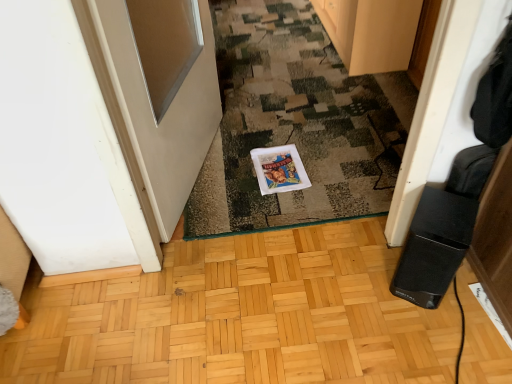
The width and height of the screenshot is (512, 384). What do you see at coordinates (434, 247) in the screenshot?
I see `black plastic speaker at lower right` at bounding box center [434, 247].

Find the location of a particular element. This screenshot has width=512, height=384. camouflage carpet at center is located at coordinates (296, 124).

Is wooden cabinet at upper center wider than camouflage carpet at center?

No, wooden cabinet at upper center is not wider than camouflage carpet at center.

Does point (394, 45) come in front of point (185, 211)?

No, (394, 45) is behind (185, 211).

Who is more distant, wooden cabinet at upper center or camouflage carpet at center?

Positioned behind is wooden cabinet at upper center.

Consider the image. Looking at the image, does white glossy door at left seem bigger or smaller compared to camouflage carpet at center?

Clearly, white glossy door at left is smaller in size than camouflage carpet at center.

From a real-world perspective, which object rests below the other?

camouflage carpet at center is physically lower.

Do you think white glossy door at left is within camouflage carpet at center, or outside of it?

white glossy door at left lies outside camouflage carpet at center.

Is white glossy postcard at center with black plastic speaker at lower right?

white glossy postcard at center and black plastic speaker at lower right are clearly separated.

From the image's perspective, would you say white glossy postcard at center is shown under black plastic speaker at lower right?

No, from the image's perspective, white glossy postcard at center is not below black plastic speaker at lower right.

Would you say white glossy postcard at center contains black plastic speaker at lower right?

Definitely not — black plastic speaker at lower right is not inside white glossy postcard at center.

From the image's perspective, would you say black plastic speaker at lower right is shown under white glossy door at left?

Yes, from the image's perspective, black plastic speaker at lower right is below white glossy door at left.

From a real-world perspective, who is located higher, black plastic speaker at lower right or white glossy door at left?

white glossy door at left, from a real-world perspective.

Does black plastic speaker at lower right have a larger size compared to white glossy door at left?

No.

Is black plastic speaker at lower right aimed at white glossy door at left?

No, black plastic speaker at lower right is not aimed at white glossy door at left.

From a real-world perspective, relative to black plastic speaker at lower right, is camouflage carpet at center vertically above or below?

In terms of real-world spatial position, camouflage carpet at center is below black plastic speaker at lower right.

Which is behind, point (258, 88) or point (445, 205)?

The point (258, 88) is more distant.

Is camouflage carpet at center far from black plastic speaker at lower right?

camouflage carpet at center is actually quite close to black plastic speaker at lower right.

From a real-world perspective, is white glossy door at left over wooden cabinet at upper center?

Indeed, from a real-world perspective, white glossy door at left stands above wooden cabinet at upper center.

In the image, is white glossy door at left positioned in front of or behind wooden cabinet at upper center?

white glossy door at left is positioned closer to the viewer than wooden cabinet at upper center.

Considering the sizes of objects white glossy door at left and wooden cabinet at upper center in the image provided, who is smaller, white glossy door at left or wooden cabinet at upper center?

white glossy door at left is smaller.

Locate an element on the screen. appliance on the right side of white glossy door at left is located at coordinates (434, 247).

Is white glossy door at left to the right of black plastic speaker at lower right from the viewer's perspective?

Incorrect, white glossy door at left is not on the right side of black plastic speaker at lower right.

Is point (162, 184) in front of point (424, 263)?

That is False.

Looking at their sizes, would you say white glossy door at left is wider or thinner than black plastic speaker at lower right?

Clearly, white glossy door at left has less width compared to black plastic speaker at lower right.

At what (x,y) coordinates should I click in order to perform the action: click on doormat on the left side of wooden cabinet at upper center. Please return your answer as a coordinate pair (x, y). The image size is (512, 384). Looking at the image, I should click on (296, 124).

Locate an element on the screen. The width and height of the screenshot is (512, 384). door located in front of the camouflage carpet at center is located at coordinates (165, 114).

When comparing their distances from black plastic speaker at lower right, does white glossy door at left or camouflage carpet at center seem closer?

camouflage carpet at center is positioned closer to the anchor black plastic speaker at lower right.

Which object lies further to the anchor point white glossy postcard at center, black plastic speaker at lower right or camouflage carpet at center?

Based on the image, black plastic speaker at lower right appears to be further to white glossy postcard at center.

Looking at the image, which one is located closer to black plastic speaker at lower right, wooden cabinet at upper center or white glossy door at left?

Based on the image, white glossy door at left appears to be nearer to black plastic speaker at lower right.

From the image, which object appears to be farther from white glossy postcard at center, wooden cabinet at upper center or black plastic speaker at lower right?

wooden cabinet at upper center.

From the image, which object appears to be farther from wooden cabinet at upper center, camouflage carpet at center or black plastic speaker at lower right?

Among the two, black plastic speaker at lower right is located further to wooden cabinet at upper center.

Considering their positions, is white glossy door at left positioned closer to wooden cabinet at upper center than camouflage carpet at center?

The object closer to wooden cabinet at upper center is camouflage carpet at center.

From the image, which object appears to be nearer to white glossy postcard at center, black plastic speaker at lower right or wooden cabinet at upper center?

black plastic speaker at lower right is closer to white glossy postcard at center.

Based on their spatial positions, is black plastic speaker at lower right or white glossy postcard at center further from camouflage carpet at center?

black plastic speaker at lower right lies further to camouflage carpet at center than the other object.

In order to click on door between wooden cabinet at upper center and black plastic speaker at lower right from top to bottom in this screenshot , I will do `click(165, 114)`.

Find the location of a particular element. The height and width of the screenshot is (384, 512). doormat located between white glossy door at left and white glossy postcard at center in the depth direction is located at coordinates (296, 124).

Where is `doormat between wooden cabinet at upper center and black plastic speaker at lower right vertically`? The width and height of the screenshot is (512, 384). doormat between wooden cabinet at upper center and black plastic speaker at lower right vertically is located at coordinates (296, 124).

Find the location of `door between camouflage carpet at center and black plastic speaker at lower right in the up-down direction`. door between camouflage carpet at center and black plastic speaker at lower right in the up-down direction is located at coordinates (165, 114).